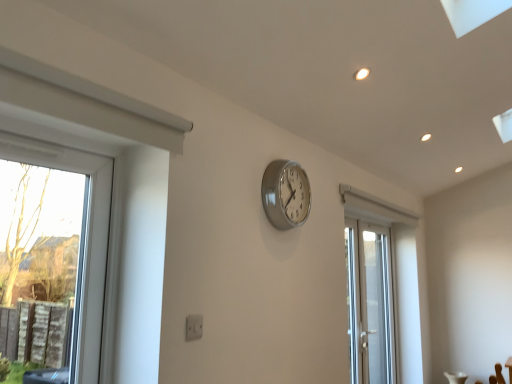
Question: Considering the positions of silver metallic clock at center and white glossy door at center-right in the image, is silver metallic clock at center wider or thinner than white glossy door at center-right?

Choices:
 (A) thin
 (B) wide

Answer: (A)

Question: From the image's perspective, is silver metallic clock at center positioned above or below white glossy door at center-right?

Choices:
 (A) above
 (B) below

Answer: (A)

Question: Which is correct: silver metallic clock at center is inside white glossy door at center-right, or outside of it?

Choices:
 (A) inside
 (B) outside

Answer: (B)

Question: Is white glossy door at center-right taller or shorter than silver metallic clock at center?

Choices:
 (A) short
 (B) tall

Answer: (B)

Question: Is white glossy door at center-right inside or outside of silver metallic clock at center?

Choices:
 (A) outside
 (B) inside

Answer: (A)

Question: From the image's perspective, is white glossy door at center-right above or below silver metallic clock at center?

Choices:
 (A) below
 (B) above

Answer: (A)

Question: Considering the positions of white glossy door at center-right and silver metallic clock at center in the image, is white glossy door at center-right wider or thinner than silver metallic clock at center?

Choices:
 (A) thin
 (B) wide

Answer: (B)